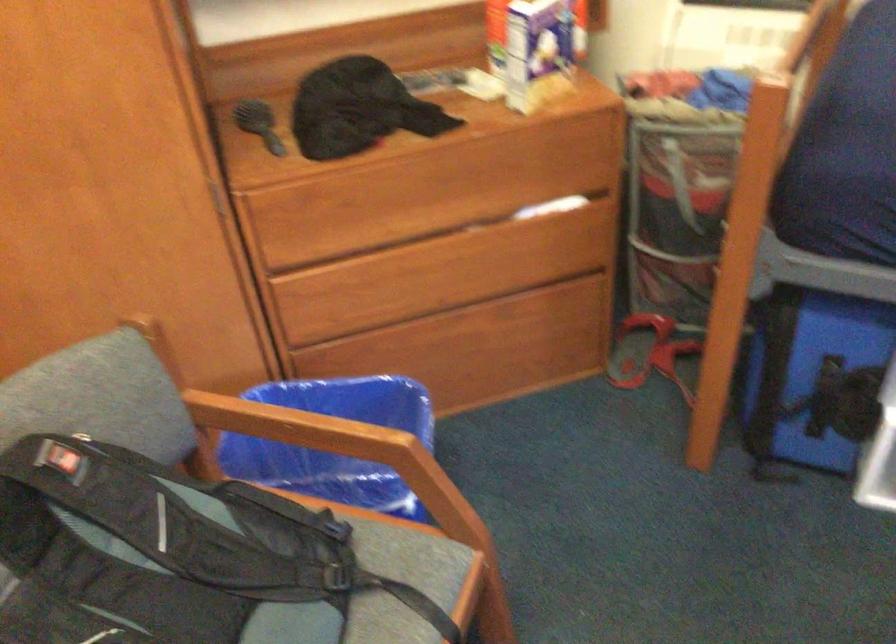
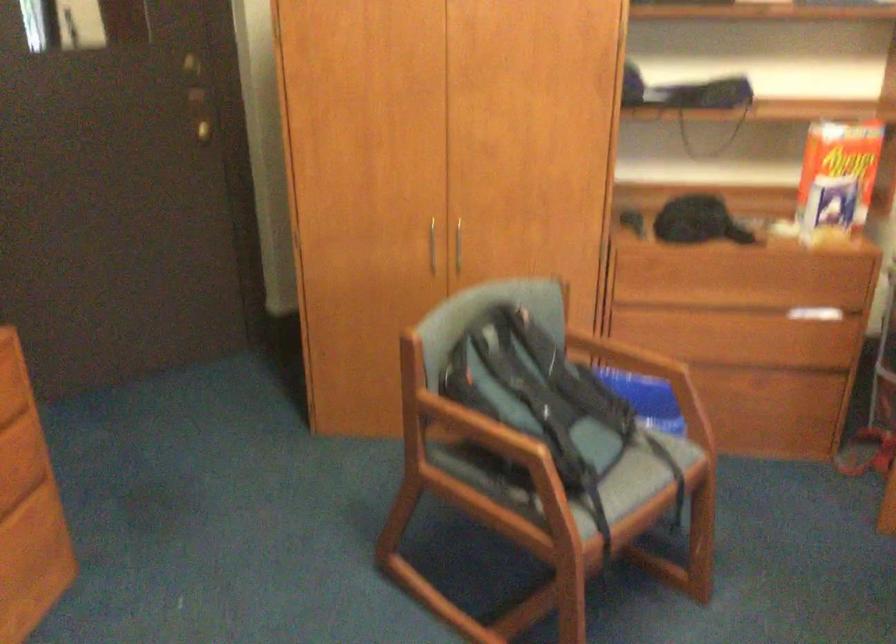
Question: What movement of the cameraman would produce the second image?

Choices:
 (A) Left
 (B) Right
 (C) Forward
 (D) Backward

Answer: (D)